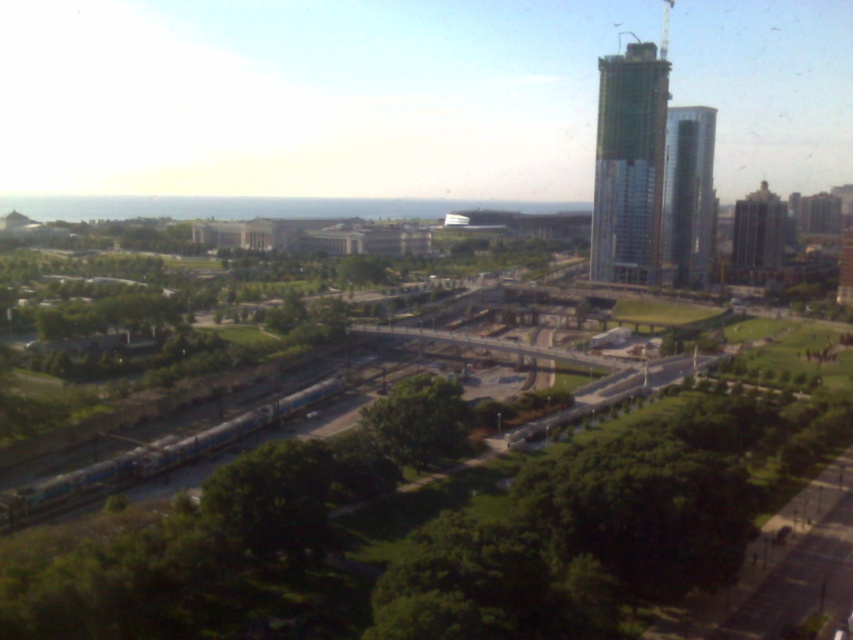
You are a city planner evaluating the urban layout. Considering the glassy silver skyscraper at right and the green leafy tree at center, which object occupies more visual space in the image?

The glassy silver skyscraper at right is larger in size than the green leafy tree at center, so it occupies more visual space in the image.

You are standing at the construction site in the midground of the urban landscape. You notice a point marked at coordinates (628, 164). What does this point represent?

The point at (628, 164) represents the green glass building at upper right.

You are a drone operator trying to capture aerial footage of the green leafy tree at center and the glassy silver skyscraper at right. From your current position above the park, can you see both objects simultaneously in your camera frame without moving the drone?

The green leafy tree at center is behind the glassy silver skyscraper at right, so the tree might be obscured by the skyscraper in your current position. You may need to adjust the drone to ensure both are visible.